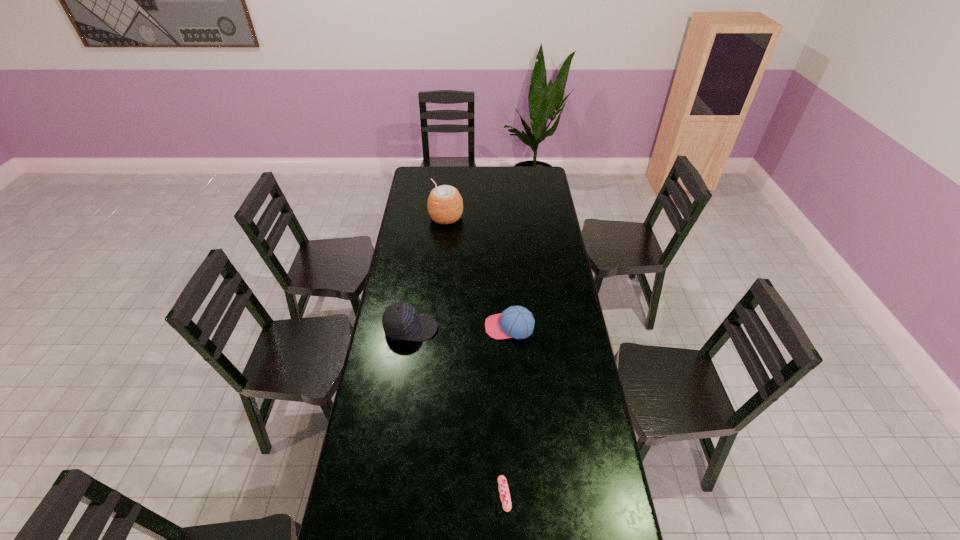
Image resolution: width=960 pixels, height=540 pixels. I want to click on vacant space located on the front-facing side of the right baseball cap, so click(399, 327).

The width and height of the screenshot is (960, 540). What are the coordinates of `free space located on the front-facing side of the right baseball cap` in the screenshot? It's located at (406, 327).

Find the location of a particular element. The width and height of the screenshot is (960, 540). vacant space located on the front-facing side of the right baseball cap is located at coordinates pyautogui.click(x=395, y=327).

Identify the location of vacant region located on the left of the nearest object. (415, 494).

Identify the location of coconut at the left edge. The width and height of the screenshot is (960, 540). (445, 205).

What are the coordinates of `baseball cap located in the left edge section of the desktop` in the screenshot? It's located at coord(400,320).

Image resolution: width=960 pixels, height=540 pixels. In the image, there is a desktop. What are the coordinates of `vacant space at the far edge` in the screenshot? It's located at [x=519, y=171].

Where is `vacant region at the left edge of the desktop`? The image size is (960, 540). vacant region at the left edge of the desktop is located at coordinates (430, 235).

The height and width of the screenshot is (540, 960). I want to click on free location at the right edge of the desktop, so click(537, 190).

Find the location of `blank area at the far right corner`. blank area at the far right corner is located at coordinates (542, 182).